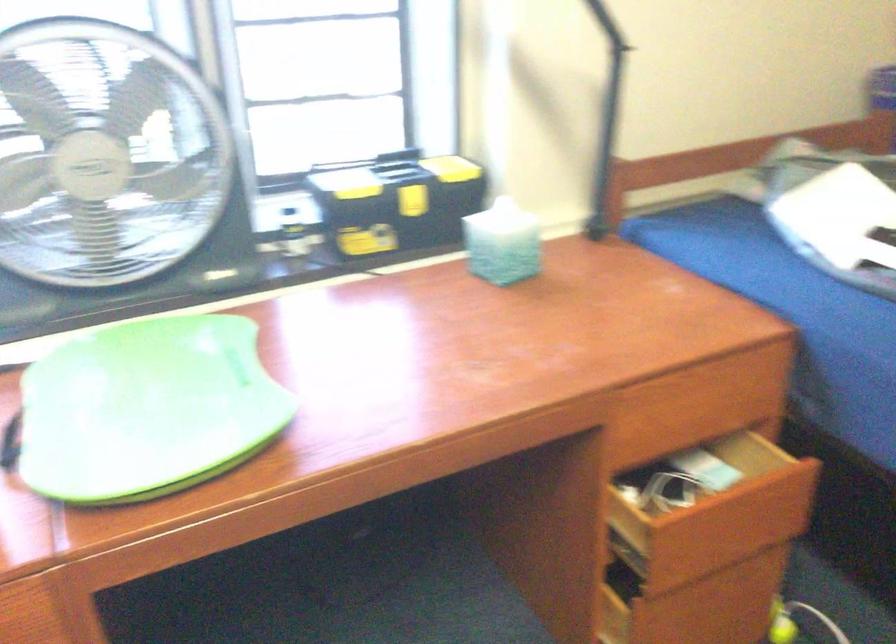
This screenshot has height=644, width=896. Identify the location of green lap desk. (147, 409).